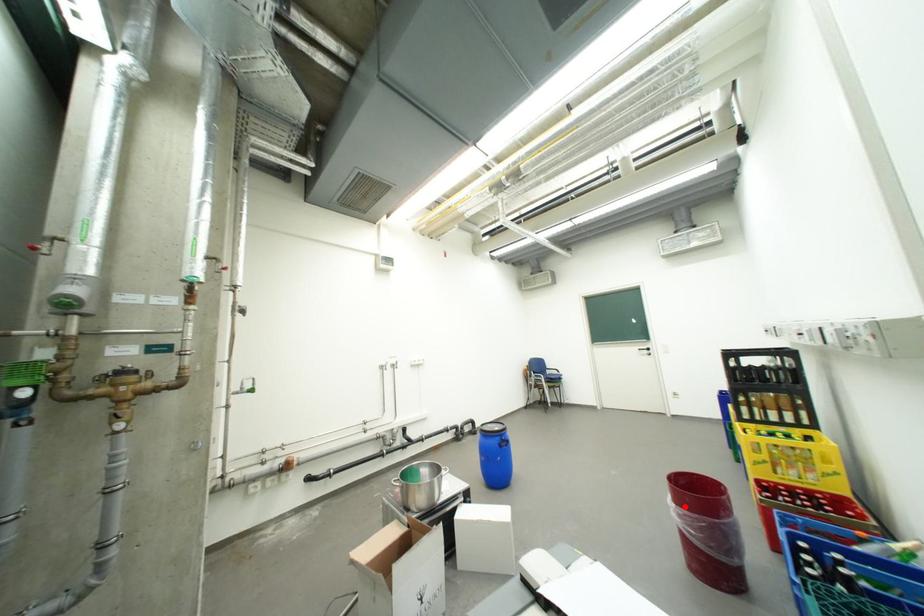
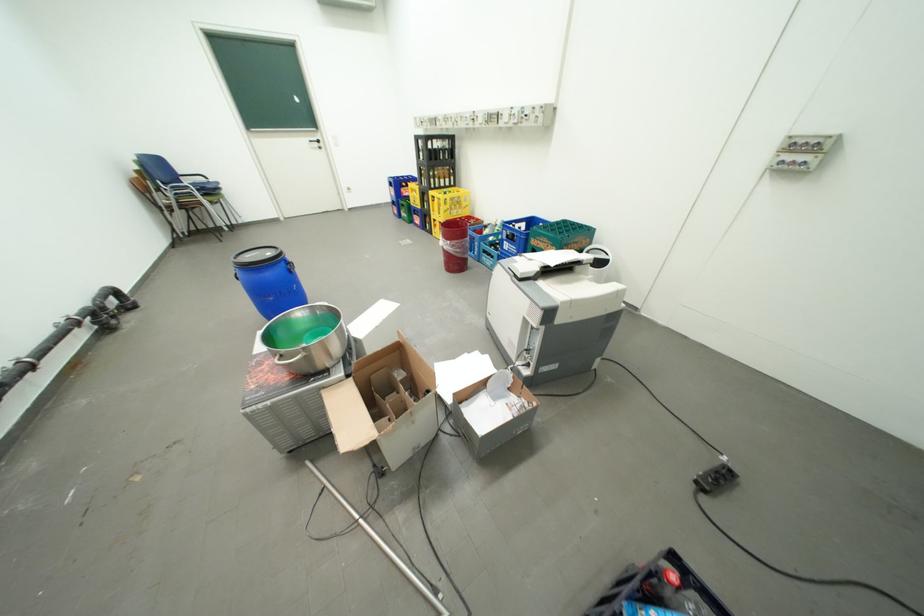
Question: I am providing you with two images of the same scene from different viewpoints. Given a red point in image1, look at the same physical point in image2. Is it:

Choices:
 (A) Closer to the viewpoint
 (B) Farther from the viewpoint

Answer: (A)